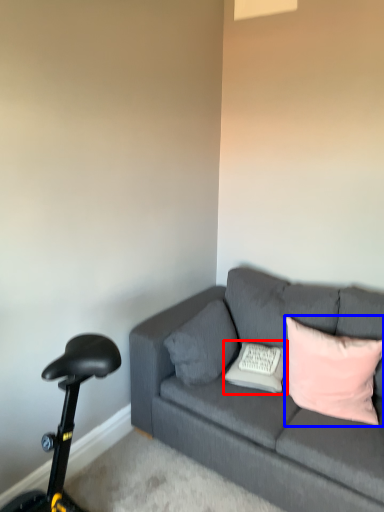
Question: Which point is further to the camera, pillow (highlighted by a red box) or pillow (highlighted by a blue box)?

Choices:
 (A) pillow
 (B) pillow

Answer: (A)